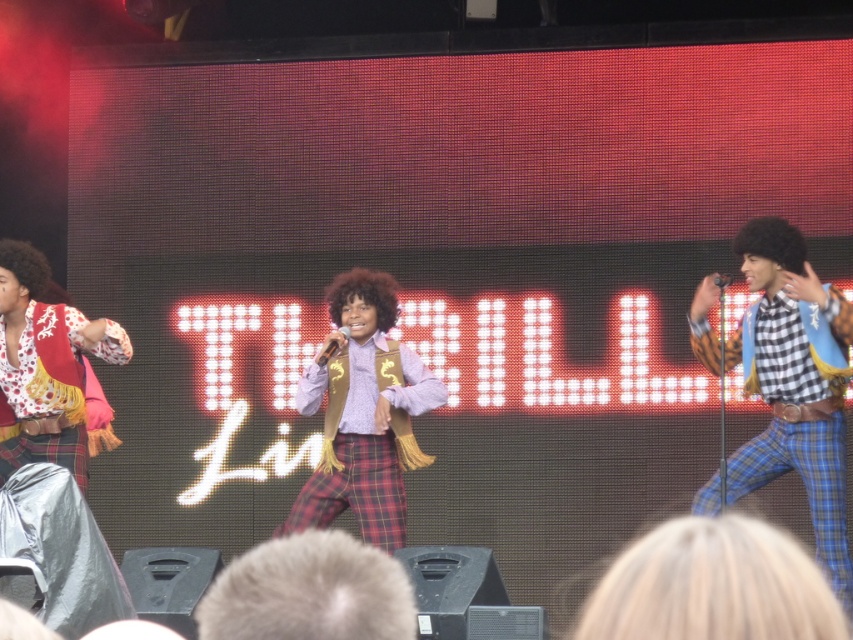
From the picture: Who is lower down, checkered fabric pants at right or plaid fabric pants at center?

checkered fabric pants at right is lower down.

What do you see at coordinates (788, 380) in the screenshot? The height and width of the screenshot is (640, 853). I see `checkered fabric pants at right` at bounding box center [788, 380].

You are a GUI agent. You are given a task and a screenshot of the screen. Output one action in this format:
    pyautogui.click(x=<x>, y=<y>)
    Task: Click on the checkered fabric pants at right
    This screenshot has height=640, width=853.
    Given the screenshot: What is the action you would take?
    pyautogui.click(x=788, y=380)

Who is lower down, plaid fabric pants at center or fuzzy brown afro at center?

fuzzy brown afro at center

Where is `plaid fabric pants at center`? Image resolution: width=853 pixels, height=640 pixels. plaid fabric pants at center is located at coordinates (363, 413).

Can you confirm if checkered fabric pants at right is positioned below blonde hair at center?

No.

Who is more distant from viewer, [787,371] or [741,582]?

Positioned behind is point [787,371].

At what (x,y) coordinates should I click in order to perform the action: click on checkered fabric pants at right. Please return your answer as a coordinate pair (x, y). The image size is (853, 640). Looking at the image, I should click on (788, 380).